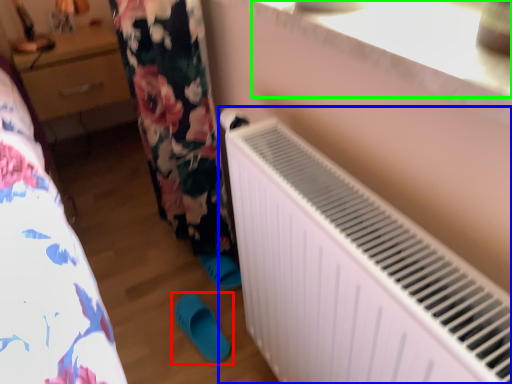
Question: Based on their relative distances, which object is nearer to footwear (highlighted by a red box)? Choose from radiator (highlighted by a blue box) and window sill (highlighted by a green box).

Choices:
 (A) radiator
 (B) window sill

Answer: (A)